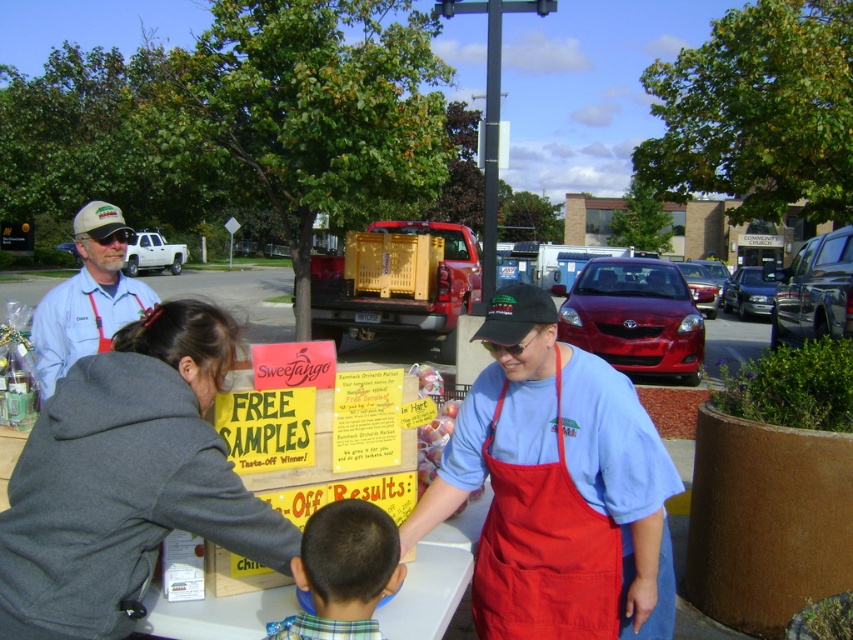
You are a participant at the event and want to identify the volunteer with the taller item between the red fabric apron at center and the plaid shirt at lower center. Which one should you approach?

The volunteer wearing the red fabric apron at center has the taller item since the red fabric apron at center is taller than the plaid shirt at lower center.

You are a visitor at the event and want to approach the table with the free samples. As you walk towards the table, which object will you encounter first, the red fabric apron at center or the plaid shirt at lower center?

The red fabric apron at center is further to the viewer than the plaid shirt at lower center, so you will encounter the red fabric apron at center first as you approach the table.